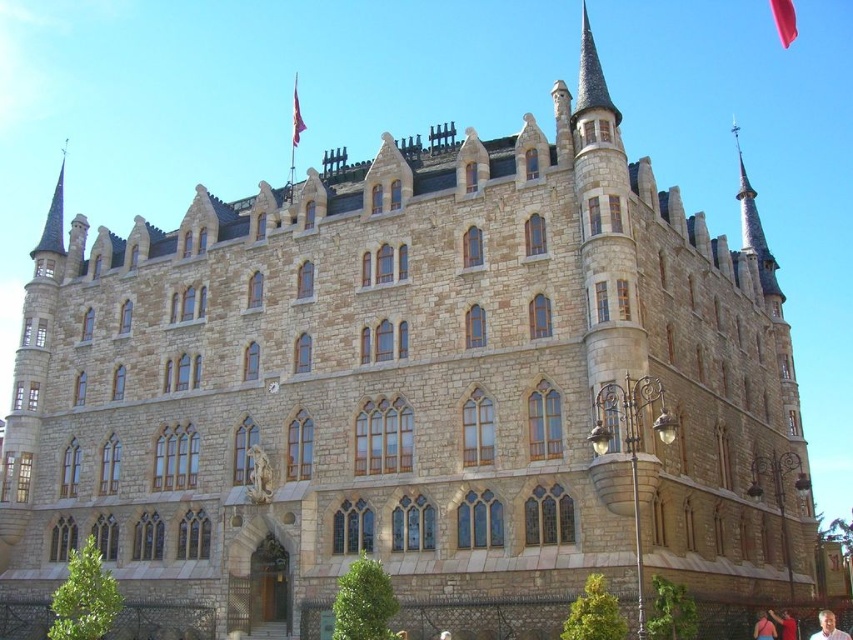
Identify the location of white hair at lower right. (828, 627).

Who is more forward, (825, 620) or (793, 627)?

Positioned in front is point (825, 620).

Identify the location of white hair at lower right. This screenshot has height=640, width=853. (828, 627).

Is red shirt at lower right bigger than red fabric shirt at lower right?

Correct, red shirt at lower right is larger in size than red fabric shirt at lower right.

Is red shirt at lower right smaller than red fabric shirt at lower right?

No, red shirt at lower right is not smaller than red fabric shirt at lower right.

Who is more forward, (788, 620) or (764, 612)?

Positioned in front is point (788, 620).

Locate an element on the screen. The height and width of the screenshot is (640, 853). red shirt at lower right is located at coordinates (784, 624).

Is point (828, 616) more distant than point (759, 625)?

No, it is not.

Is white hair at lower right shorter than red fabric shirt at lower right?

In fact, white hair at lower right may be taller than red fabric shirt at lower right.

At what (x,y) coordinates should I click in order to perform the action: click on white hair at lower right. Please return your answer as a coordinate pair (x, y). Image resolution: width=853 pixels, height=640 pixels. Looking at the image, I should click on (828, 627).

This screenshot has width=853, height=640. In order to click on white hair at lower right in this screenshot , I will do `click(828, 627)`.